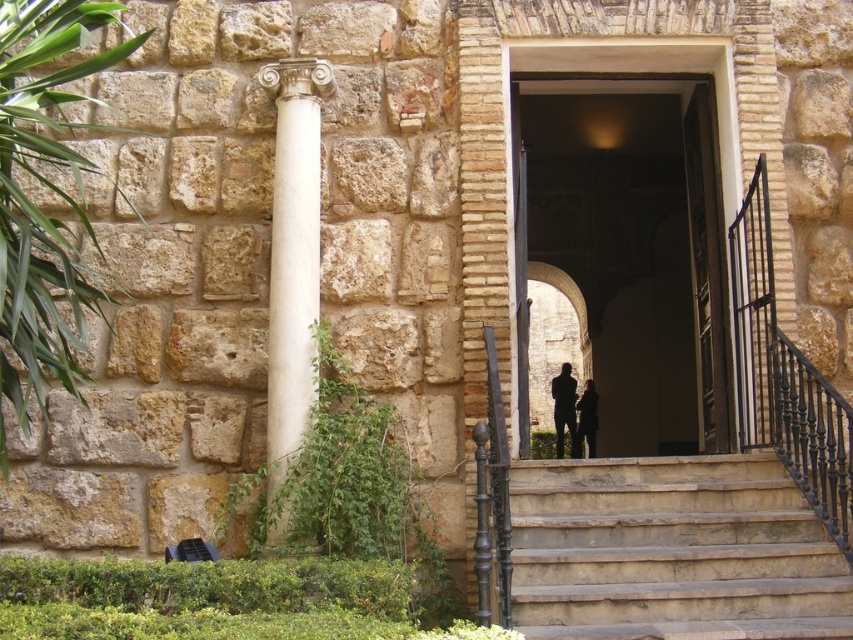
You are standing in front of the historic stone building and want to take a photo of the entrance. You notice two points marked as point 1 at coordinates (x=651, y=211) and point 2 at coordinates (x=270, y=490). Which point is closer to your camera lens when taking the photo?

Point 1 at coordinates (x=651, y=211) is closer to the camera lens because it is further to the camera than point 2 at coordinates (x=270, y=490).